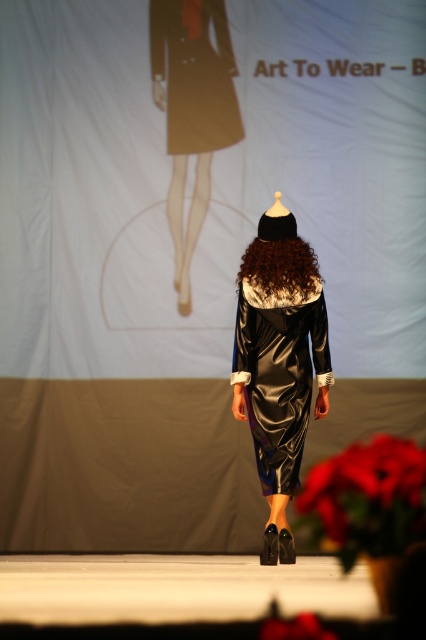
You are a fashion designer observing the runway show. You need to place a 1.5 meter long decorative ribbon between the matte brown skirt at upper center and the brown furry wig at center. Will the ribbon fit perfectly between them without overlapping either object?

The distance between the matte brown skirt at upper center and the brown furry wig at center is 1.58 meters. Since the ribbon is 1.5 meters long, it will fit between them with a small gap of 0.08 meters remaining.

You are a photographer standing in the runway area. You want to take a closeup shot of the satin dress at center. Considering your current position, is the distance sufficient to capture the dress clearly without moving closer?

The satin dress at center is 5.46 meters from viewer, so the distance is sufficient to capture the dress clearly without moving closer.